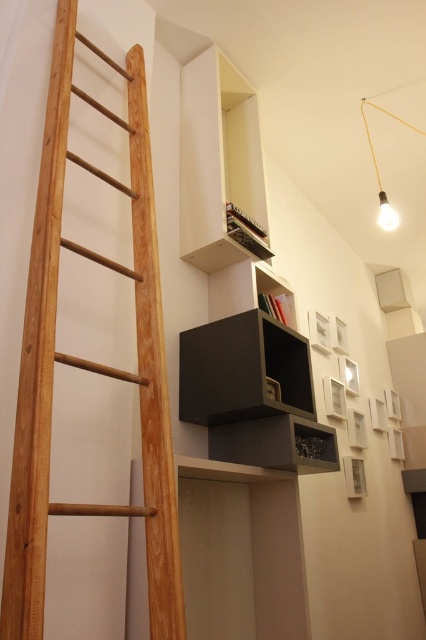
Question: Which point is farther to the camera?

Choices:
 (A) white matte shelf at upper center
 (B) matte black shelf at center
 (C) matte black shelf at upper center

Answer: (C)

Question: Does white matte shelf at upper center have a larger size compared to matte black shelf at center?

Choices:
 (A) yes
 (B) no

Answer: (A)

Question: Does natural wood ladder at left appear under matte black shelf at upper center?

Choices:
 (A) yes
 (B) no

Answer: (B)

Question: Is natural wood ladder at left closer to camera compared to matte black shelf at upper center?

Choices:
 (A) no
 (B) yes

Answer: (B)

Question: Which of the following is the farthest from the observer?

Choices:
 (A) [x=8, y=541]
 (B) [x=264, y=179]
 (C) [x=330, y=467]

Answer: (B)

Question: Which point is closer to the camera?

Choices:
 (A) white matte shelf at upper center
 (B) natural wood ladder at left

Answer: (B)